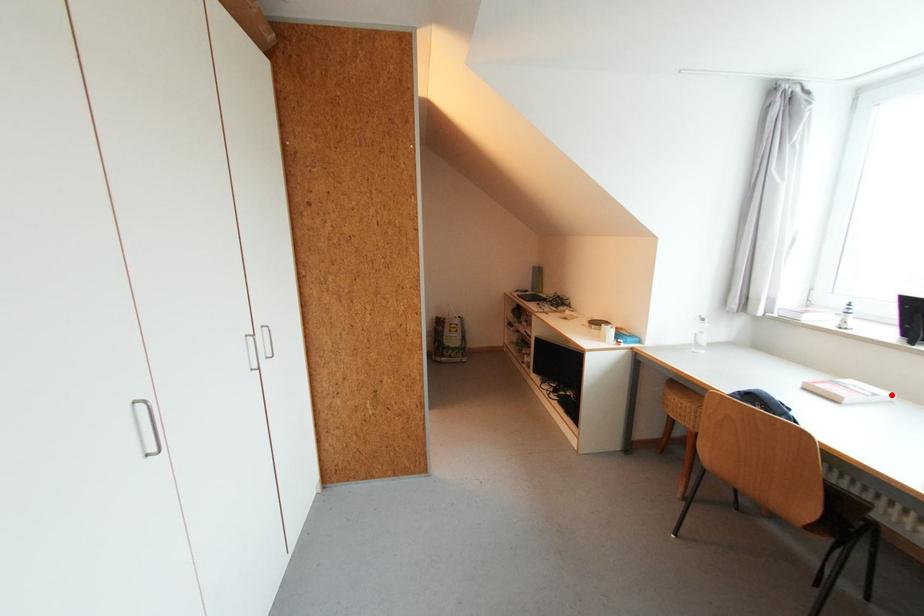
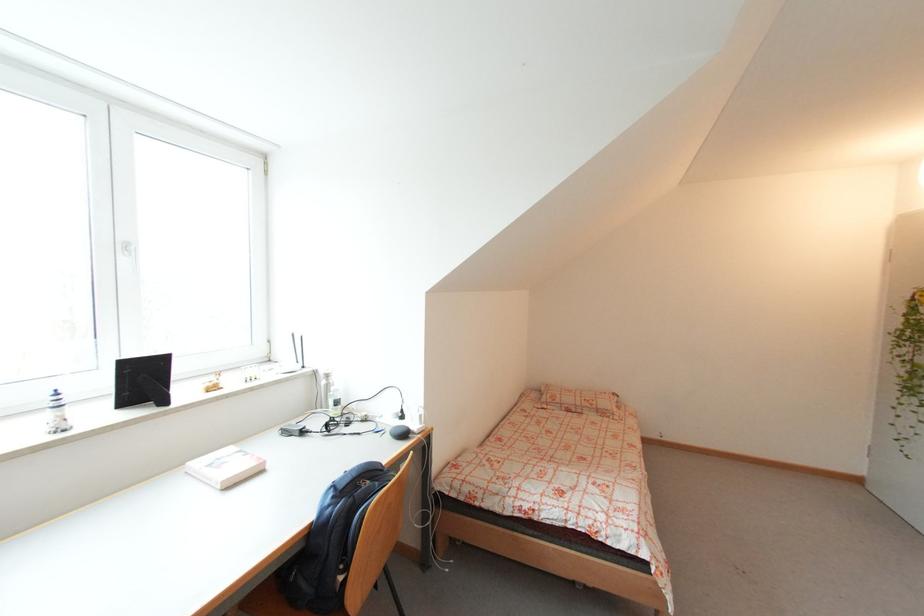
Where in the second image is the point corresponding to the highlighted location from the first image?

(236, 450)